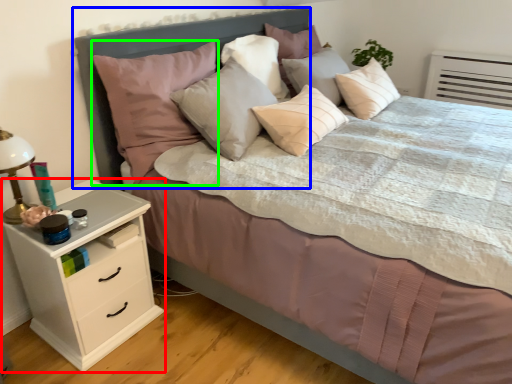
Question: Which object is positioned farthest from chest of drawers (highlighted by a red box)? Select from headboard (highlighted by a blue box) and pillow (highlighted by a green box).

Choices:
 (A) headboard
 (B) pillow

Answer: (A)